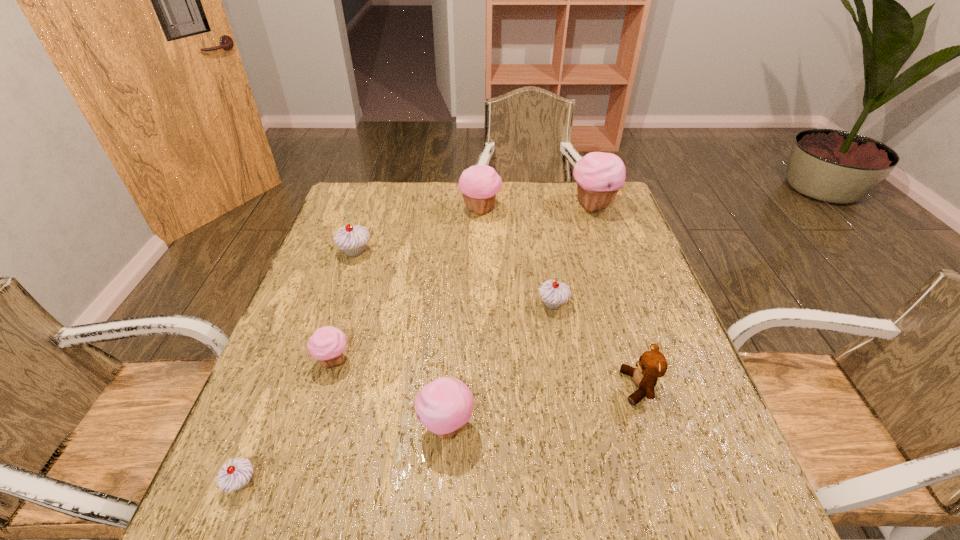
Locate an element on the screen. The height and width of the screenshot is (540, 960). gray cupcake that can be found as the second closest to the rightmost cupcake is located at coordinates (x=352, y=239).

Locate an element on the screen. This screenshot has width=960, height=540. gray cupcake identified as the third closest to the sixth farthest cupcake is located at coordinates (352, 239).

Locate an element on the screen. This screenshot has width=960, height=540. vacant space that satisfies the following two spatial constraints: 1. on the back side of the tallest object; 2. on the left side of the second biggest pink cupcake is located at coordinates (480, 206).